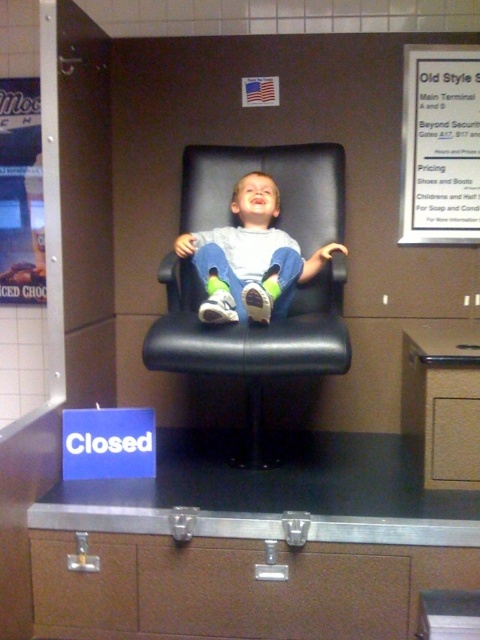
Question: Does white paper at upper right have a smaller size compared to matte black chair at center?

Choices:
 (A) no
 (B) yes

Answer: (B)

Question: Is black leather swivel chair at center to the left of white paper at upper right from the viewer's perspective?

Choices:
 (A) yes
 (B) no

Answer: (A)

Question: Estimate the real-world distances between objects in this image. Which object is closer to the white paper at upper right?

Choices:
 (A) matte black chair at center
 (B) black leather swivel chair at center

Answer: (B)

Question: Which of the following is the farthest from the observer?

Choices:
 (A) black leather swivel chair at center
 (B) white paper at upper right
 (C) matte black chair at center

Answer: (B)

Question: Which point is closer to the camera taking this photo?

Choices:
 (A) (464, 204)
 (B) (255, 193)
 (C) (206, 342)

Answer: (C)

Question: Does black leather swivel chair at center appear on the right side of matte black chair at center?

Choices:
 (A) yes
 (B) no

Answer: (B)